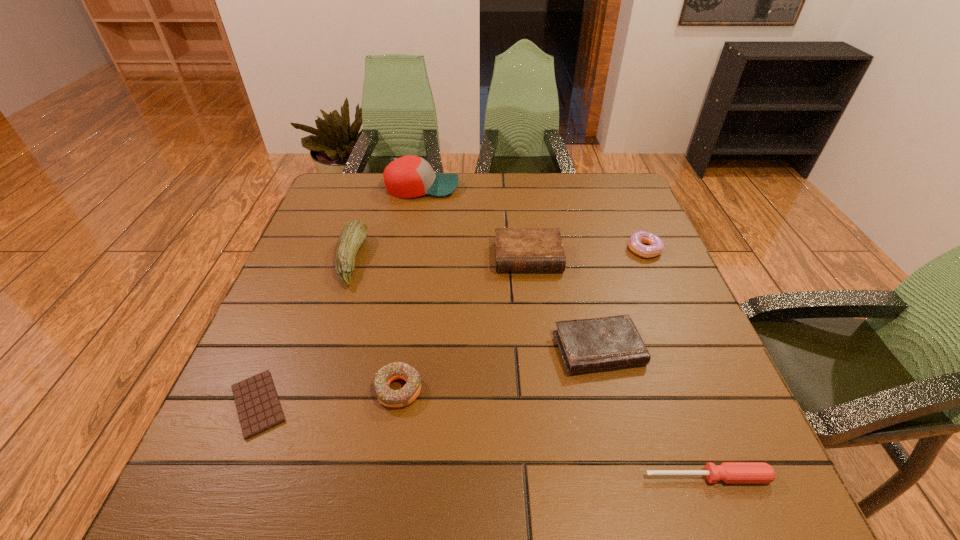
Find the location of a particular element. object that is at the near edge is located at coordinates (730, 472).

Identify the location of zucchini that is at the left edge. The height and width of the screenshot is (540, 960). (354, 232).

I want to click on chocolate bar positioned at the left edge, so click(258, 407).

Locate an element on the screen. doughnut that is at the right edge is located at coordinates (656, 245).

Identify the location of diary that is at the right edge. This screenshot has width=960, height=540. (604, 343).

Identify the location of screwdriver that is at the right edge. Image resolution: width=960 pixels, height=540 pixels. (730, 472).

The height and width of the screenshot is (540, 960). In order to click on object that is positioned at the near right corner in this screenshot , I will do `click(730, 472)`.

Where is `free space at the far edge of the desktop`? The image size is (960, 540). free space at the far edge of the desktop is located at coordinates (525, 212).

The image size is (960, 540). What are the coordinates of `vacant area at the near edge` in the screenshot? It's located at (653, 458).

Identify the location of vacant space at the left edge. The height and width of the screenshot is (540, 960). (312, 250).